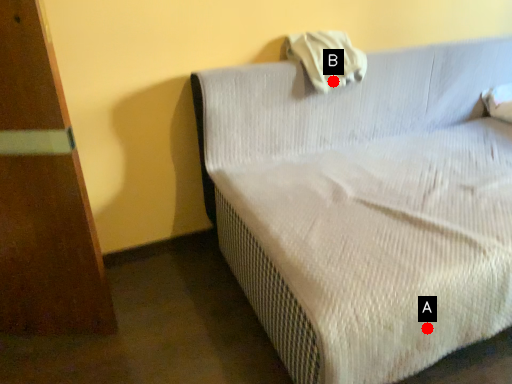
Question: Two points are circled on the image, labeled by A and B beside each circle. Which of the following is the closest to the observer?

Choices:
 (A) A is closer
 (B) B is closer

Answer: (A)